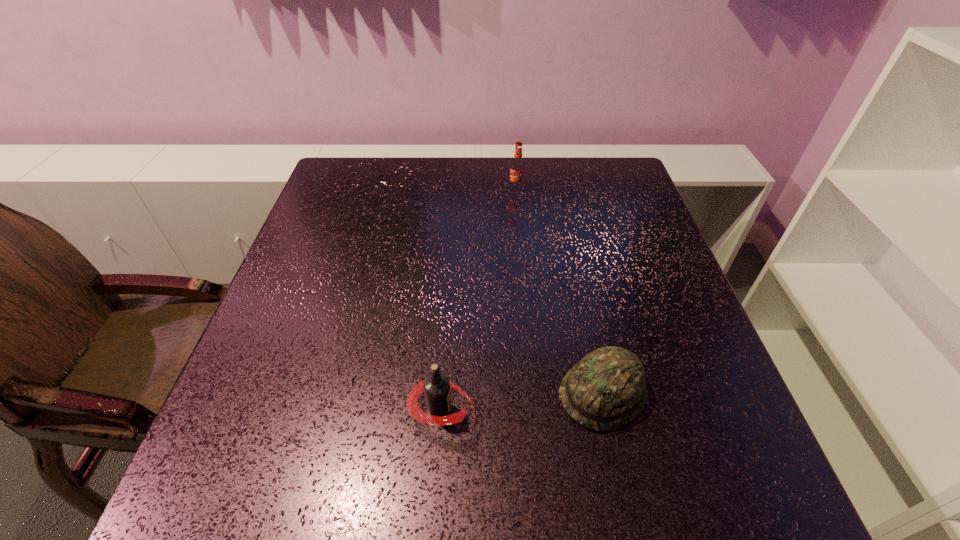
Where is `the farthest object`? The width and height of the screenshot is (960, 540). the farthest object is located at coordinates (517, 165).

The height and width of the screenshot is (540, 960). What are the coordinates of `the second object from right to left` in the screenshot? It's located at (517, 165).

This screenshot has width=960, height=540. What are the coordinates of `the leftmost object` in the screenshot? It's located at (436, 386).

You are a GUI agent. You are given a task and a screenshot of the screen. Output one action in this format:
    pyautogui.click(x=<x>, y=<y>)
    Task: Click on the nearer root beer
    The width and height of the screenshot is (960, 540).
    Given the screenshot: What is the action you would take?
    pyautogui.click(x=436, y=386)

Identify the location of the shortest object. (605, 390).

In order to click on headwear in this screenshot , I will do `click(605, 390)`.

At what (x,y) coordinates should I click in order to perform the action: click on vacant point located 0.190m on the front of the second object from left to right. Please return your answer as a coordinate pair (x, y). The height and width of the screenshot is (540, 960). Looking at the image, I should click on (520, 234).

Where is `vacant space located 0.380m on the label of the leftmost object`? vacant space located 0.380m on the label of the leftmost object is located at coordinates (691, 410).

The width and height of the screenshot is (960, 540). Find the location of `vacant area situated on the front of the headwear`. vacant area situated on the front of the headwear is located at coordinates (622, 482).

Locate an element on the screen. object located in the far edge section of the desktop is located at coordinates (517, 165).